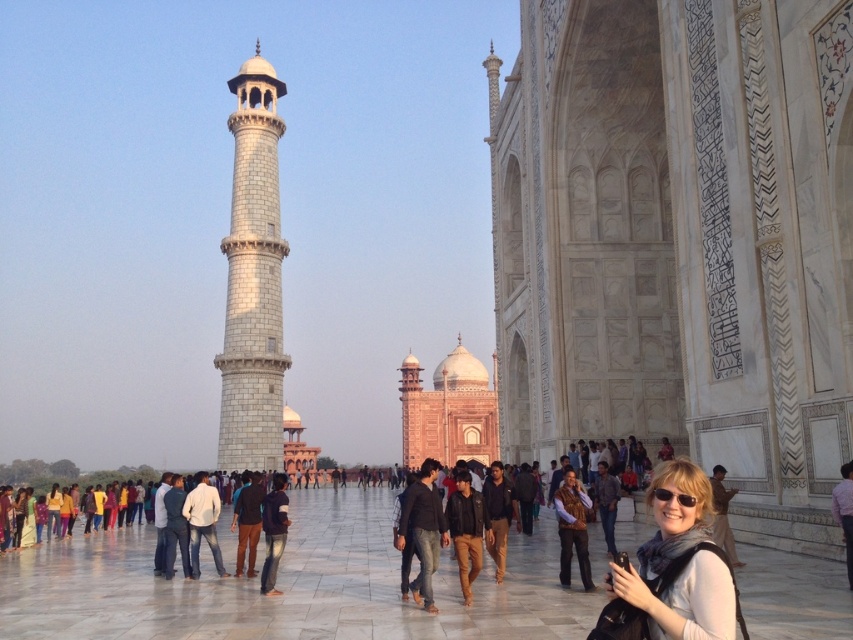
Who is higher up, white marble tower at center or matte black sunglasses at lower right?

Positioned higher is matte black sunglasses at lower right.

Is white marble tower at center smaller than matte black sunglasses at lower right?

No, white marble tower at center is not smaller than matte black sunglasses at lower right.

Does point (440, 378) lie in front of point (665, 500)?

That is False.

You are a GUI agent. You are given a task and a screenshot of the screen. Output one action in this format:
    pyautogui.click(x=<x>, y=<y>)
    Task: Click on the white marble tower at center
    The width and height of the screenshot is (853, 640).
    Given the screenshot: What is the action you would take?
    click(450, 410)

Describe the element at coordinates (450, 410) in the screenshot. Image resolution: width=853 pixels, height=640 pixels. I see `white marble tower at center` at that location.

Is point (463, 449) behind point (492, 548)?

Yes.

Image resolution: width=853 pixels, height=640 pixels. Identify the location of white marble tower at center. (450, 410).

This screenshot has height=640, width=853. I want to click on white marble tower at center, so click(450, 410).

Can you confirm if white marble minaret at center-left is smaller than dark blue fabric jacket at center?

Incorrect, white marble minaret at center-left is not smaller in size than dark blue fabric jacket at center.

Is the position of white marble minaret at center-left less distant than that of dark blue fabric jacket at center?

That is False.

Is point (281, 316) closer to viewer compared to point (497, 525)?

No, it is not.

What are the coordinates of `white marble minaret at center-left` in the screenshot? It's located at tap(253, 278).